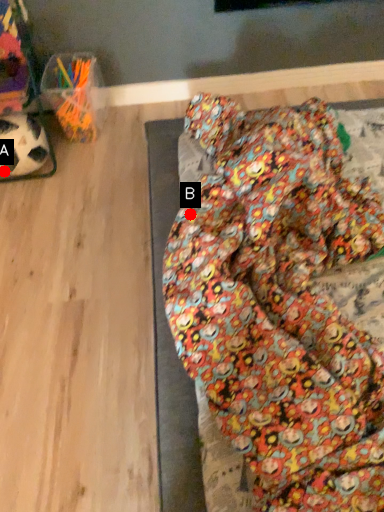
Question: Two points are circled on the image, labeled by A and B beside each circle. Which point is closer to the camera?

Choices:
 (A) A is closer
 (B) B is closer

Answer: (B)